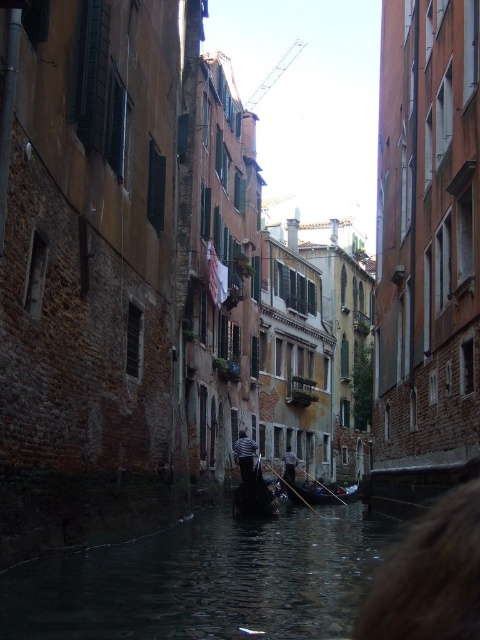
Does wooden gondola at center have a greater height compared to striped shirt at center?

Indeed, wooden gondola at center has a greater height compared to striped shirt at center.

This screenshot has height=640, width=480. What do you see at coordinates (254, 497) in the screenshot?
I see `wooden gondola at center` at bounding box center [254, 497].

Between point (253, 508) and point (243, 456), which one is positioned behind?

The point (243, 456) is more distant.

Find the location of a particular element. wooden gondola at center is located at coordinates (254, 497).

Which is more to the right, wooden gondola at center or dark gray fabric shirt at center?

dark gray fabric shirt at center

Does point (265, 497) come farther from viewer compared to point (294, 476)?

No, (265, 497) is in front of (294, 476).

Where is `wooden gondola at center`? wooden gondola at center is located at coordinates [254, 497].

Between point (302, 563) and point (252, 444), which one is positioned in front?

Point (302, 563) is more forward.

Is dark water at center smaller than striped shirt at center?

No, dark water at center is not smaller than striped shirt at center.

Does point (188, 522) lie in front of point (248, 445)?

Yes, point (188, 522) is closer to viewer.

Where is `dark water at center`? dark water at center is located at coordinates (204, 580).